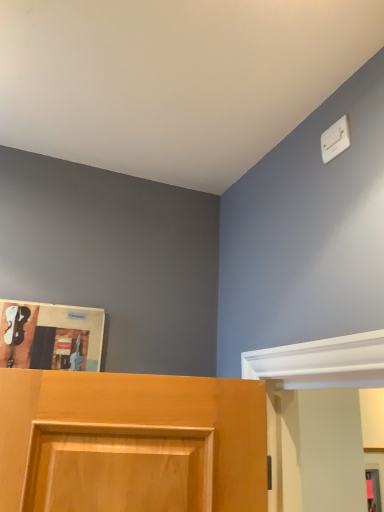
Question: Does point (329, 155) appear closer or farther from the camera than point (82, 346)?

Choices:
 (A) farther
 (B) closer

Answer: (B)

Question: From the image's perspective, relative to matte paper magazine at upper left, is white plastic light switch at upper right above or below?

Choices:
 (A) above
 (B) below

Answer: (A)

Question: Is white plastic light switch at upper right situated inside matte paper magazine at upper left or outside?

Choices:
 (A) outside
 (B) inside

Answer: (A)

Question: Looking at the image, does matte paper magazine at upper left seem bigger or smaller compared to white plastic light switch at upper right?

Choices:
 (A) big
 (B) small

Answer: (A)

Question: In terms of height, does matte paper magazine at upper left look taller or shorter compared to white plastic light switch at upper right?

Choices:
 (A) tall
 (B) short

Answer: (A)

Question: Which is correct: matte paper magazine at upper left is inside white plastic light switch at upper right, or outside of it?

Choices:
 (A) outside
 (B) inside

Answer: (A)

Question: From the image's perspective, is matte paper magazine at upper left positioned above or below white plastic light switch at upper right?

Choices:
 (A) below
 (B) above

Answer: (A)